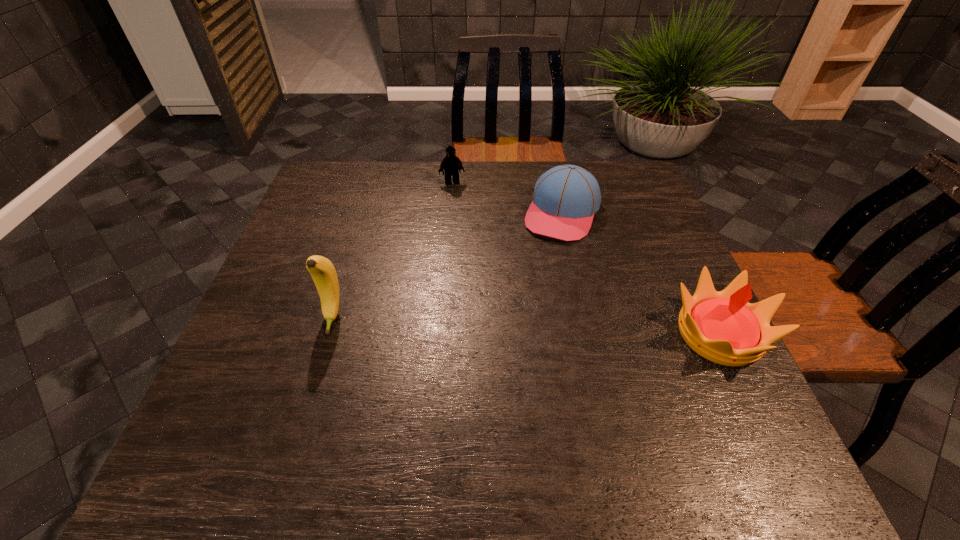
Locate an element on the screen. The image size is (960, 540). free area in between the leftmost object and the Lego is located at coordinates (393, 250).

Identify the location of vacant point located between the Lego and the banana. This screenshot has height=540, width=960. (393, 250).

Locate an element on the screen. Image resolution: width=960 pixels, height=540 pixels. free space between the farthest object and the crown is located at coordinates (586, 258).

The image size is (960, 540). I want to click on empty space that is in between the banana and the crown, so click(526, 326).

Point out which object is positioned as the third nearest to the rightmost object. Please provide its 2D coordinates. Your answer should be formatted as a tuple, i.e. [(x, y)], where the tuple contains the x and y coordinates of a point satisfying the conditions above.

[(323, 273)]

You are a GUI agent. You are given a task and a screenshot of the screen. Output one action in this format:
    pyautogui.click(x=<x>, y=<y>)
    Task: Click on the object that is the second nearest to the leftmost object
    
    Given the screenshot: What is the action you would take?
    pyautogui.click(x=451, y=164)

At what (x,y) coordinates should I click in order to perform the action: click on blank space that satisfies the following two spatial constraints: 1. from the stem of the rightmost object; 2. on the left side of the banana. Please return your answer as a coordinate pair (x, y). The image size is (960, 540). Looking at the image, I should click on (327, 334).

You are a GUI agent. You are given a task and a screenshot of the screen. Output one action in this format:
    pyautogui.click(x=<x>, y=<y>)
    Task: Click on the vacant space that satisfies the following two spatial constraints: 1. on the front side of the third object from left to right; 2. on the right side of the crown
    The image size is (960, 540).
    Given the screenshot: What is the action you would take?
    pyautogui.click(x=588, y=334)

You are a GUI agent. You are given a task and a screenshot of the screen. Output one action in this format:
    pyautogui.click(x=<x>, y=<y>)
    Task: Click on the vacant space that satisfies the following two spatial constraints: 1. on the front side of the third object from right to left; 2. on the left side of the third nearest object
    
    Given the screenshot: What is the action you would take?
    pyautogui.click(x=449, y=213)

Find the location of a particular element. vacant position in the image that satisfies the following two spatial constraints: 1. from the stem of the crown; 2. on the left side of the leftmost object is located at coordinates (327, 334).